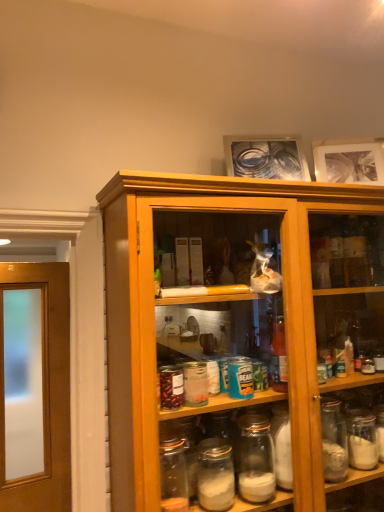
Question: From their relative heights in the image, would you say matte black picture frame at upper right, the 1th picture frame from the right, is taller or shorter than metallic silver picture frame at upper center, placed as the 1th picture frame when sorted from left to right?

Choices:
 (A) tall
 (B) short

Answer: (A)

Question: In the image, is matte black picture frame at upper right, arranged as the 2th picture frame when viewed from the left, on the left side or the right side of metallic silver picture frame at upper center, placed as the 1th picture frame when sorted from left to right?

Choices:
 (A) left
 (B) right

Answer: (B)

Question: In the image, is matte black picture frame at upper right, the 1th picture frame from the right, positioned in front of or behind metallic silver picture frame at upper center, placed as the 1th picture frame when sorted from left to right?

Choices:
 (A) front
 (B) behind

Answer: (B)

Question: Based on their positions, is metallic silver picture frame at upper center, placed as the 1th picture frame when sorted from left to right, located to the left or right of matte black picture frame at upper right, arranged as the 2th picture frame when viewed from the left?

Choices:
 (A) right
 (B) left

Answer: (B)

Question: Is point (226, 166) positioned closer to the camera than point (380, 167)?

Choices:
 (A) farther
 (B) closer

Answer: (A)

Question: Based on their sizes in the image, would you say metallic silver picture frame at upper center, placed as the 1th picture frame when sorted from left to right, is bigger or smaller than matte black picture frame at upper right, the 1th picture frame from the right?

Choices:
 (A) small
 (B) big

Answer: (B)

Question: In terms of height, does metallic silver picture frame at upper center, placed as the 1th picture frame when sorted from left to right, look taller or shorter compared to matte black picture frame at upper right, arranged as the 2th picture frame when viewed from the left?

Choices:
 (A) short
 (B) tall

Answer: (A)